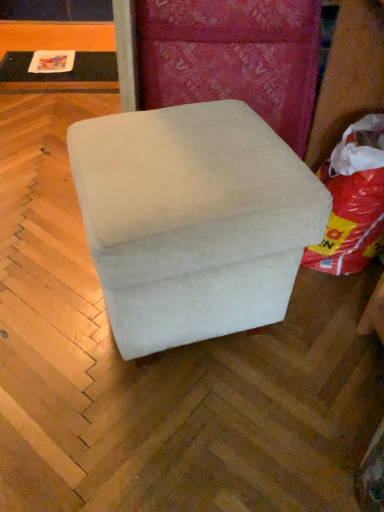
At what (x,y) coordinates should I click in order to perform the action: click on free point above matte black table at upper left (from a real-world perspective). Please return your answer as a coordinate pair (x, y). Looking at the image, I should click on (73, 66).